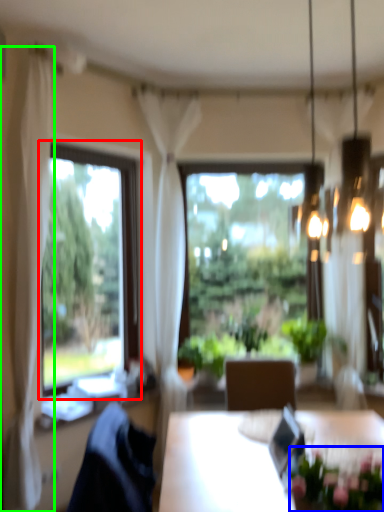
Question: Based on their relative distances, which object is nearer to window (highlighted by a red box)? Choose from floral arrangement (highlighted by a blue box) and curtain (highlighted by a green box).

Choices:
 (A) floral arrangement
 (B) curtain

Answer: (B)